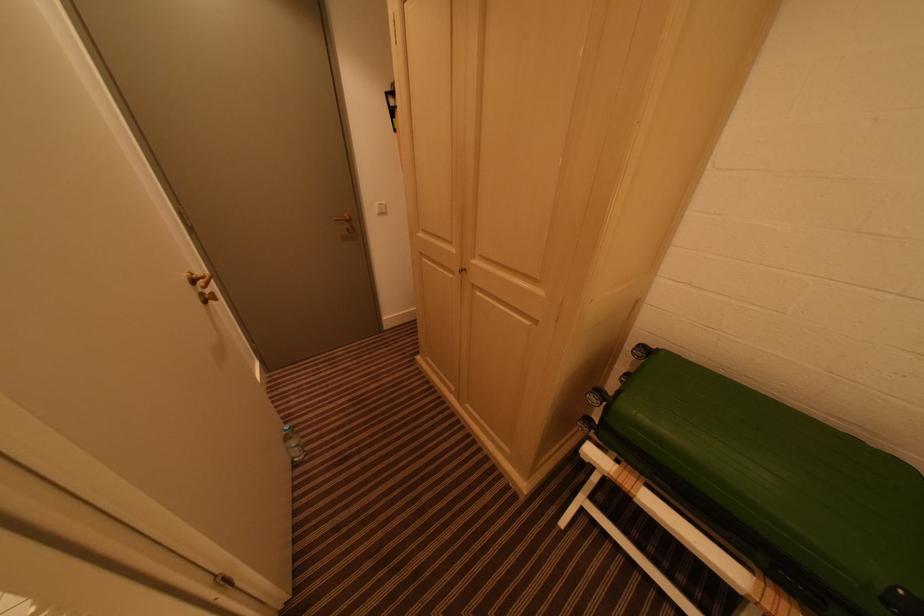
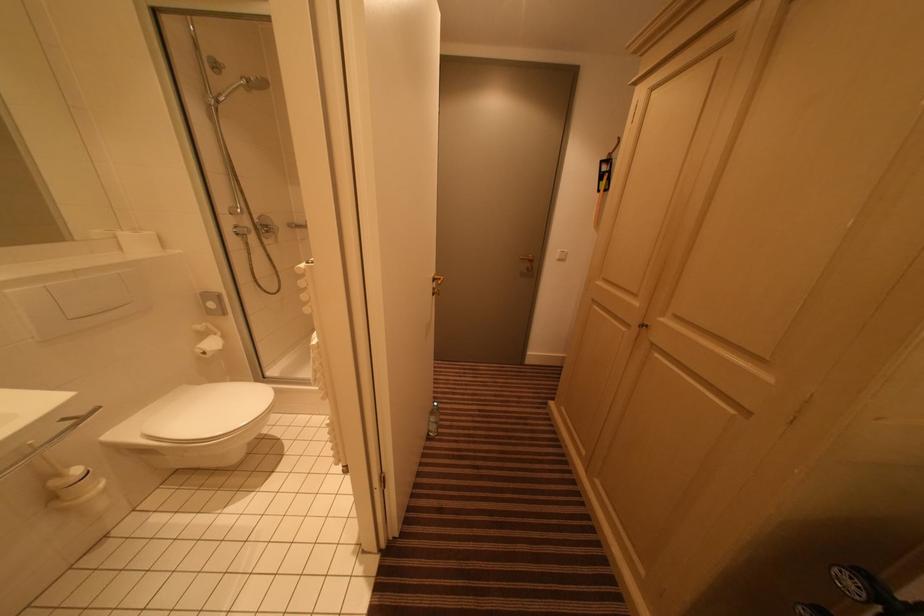
Question: The camera is either moving clockwise (left) or counter-clockwise (right) around the object. The first image is from the beginning of the video and the second image is from the end. Is the camera moving left or right when shooting the video?

Choices:
 (A) Left
 (B) Right

Answer: (B)